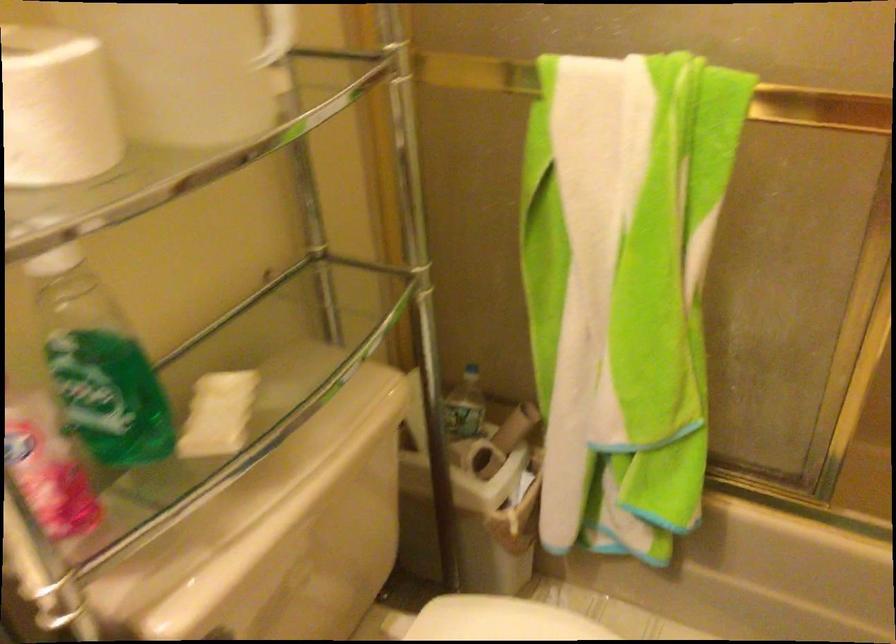
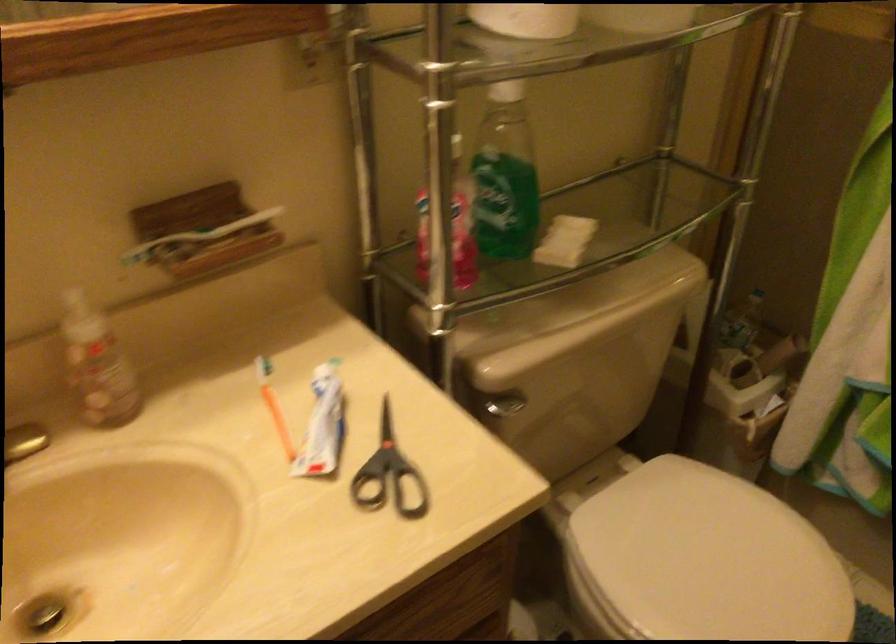
In the second image, find the point that corresponds to (507,440) in the first image.

(764, 361)